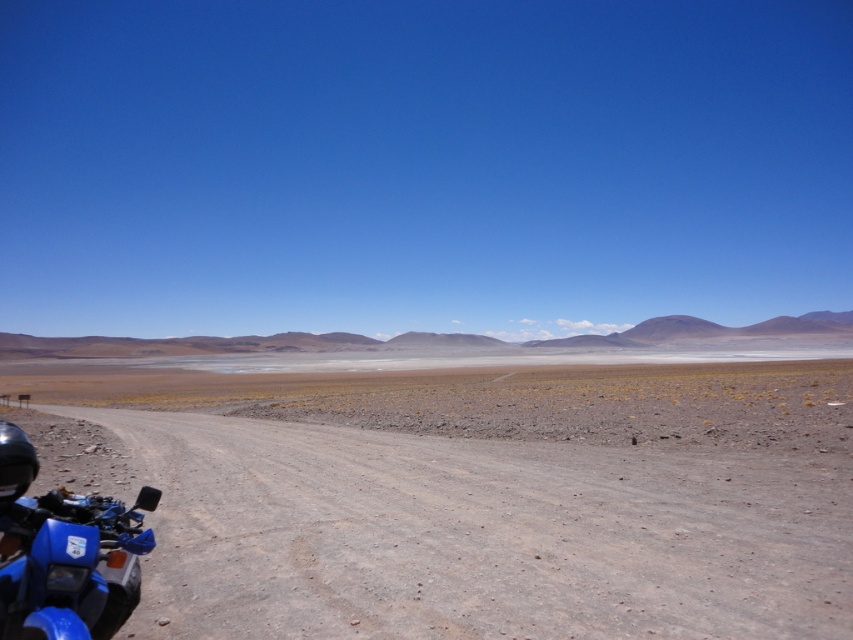
From the picture: You are a traveler standing on the blue gravel road at lower left and want to reach the blue matte motorcycle at lower left. Which direction should you move to get closer to the motorcycle?

The blue gravel road at lower left is further to the viewer than the blue matte motorcycle at lower left, so you should move forward along the road to reach the motorcycle.

You are a traveler on a dirt bike in the desert and see the blue gravel road at lower left and the blue matte motorcycle at lower left. Which object is closer to the ground?

The blue gravel road at lower left is positioned under the blue matte motorcycle at lower left, so the road is closer to the ground.

You are standing at the point marked as point (479,534) in the image. Looking towards the blue motorcycle on the left side of the road, which direction should you walk to reach the motorcycle?

The point (479,534) corresponds to the blue gravel road at lower left. To reach the blue motorcycle on the left side of the road, you should walk towards the left along the blue gravel road at lower left.